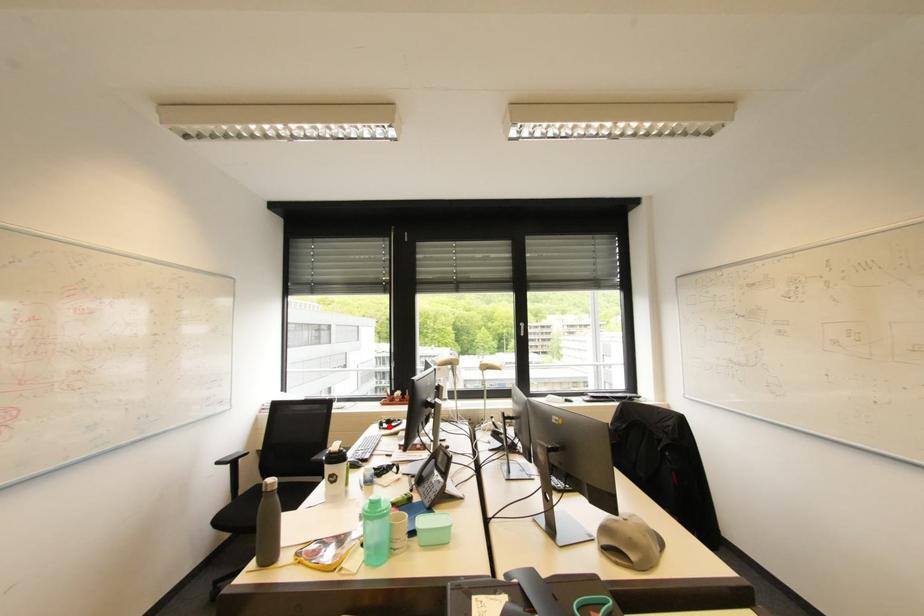
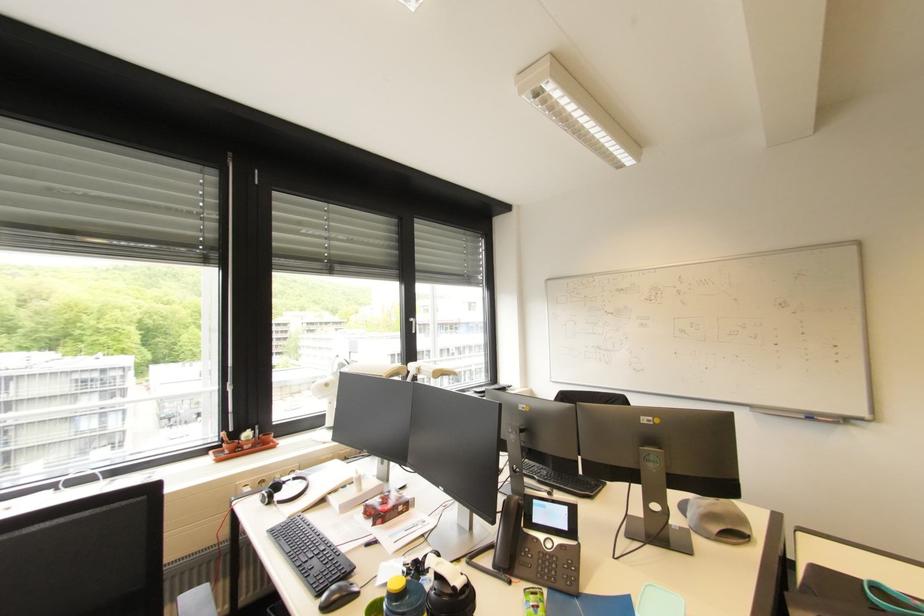
Where in the second image is the point corresponding to the highlighted location from the first image?

(283, 498)